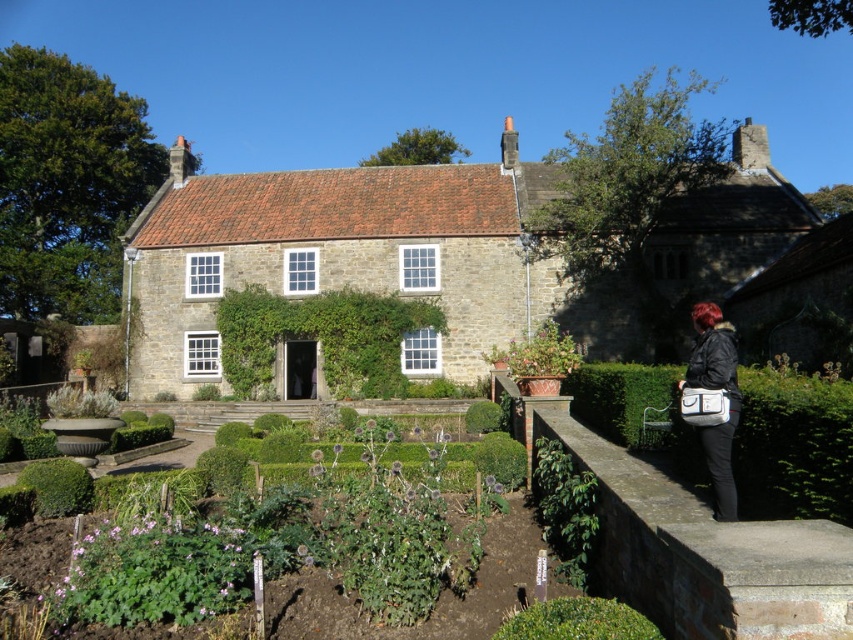
Does stone cottage at center come behind brown stone ledge at lower right?

Yes, it is behind brown stone ledge at lower right.

Does stone cottage at center have a larger size compared to brown stone ledge at lower right?

Correct, stone cottage at center is larger in size than brown stone ledge at lower right.

Find the location of a particular element. This screenshot has width=853, height=640. stone cottage at center is located at coordinates (351, 260).

Locate an element on the screen. stone cottage at center is located at coordinates (351, 260).

Can you confirm if stone cottage at center is positioned to the left of green leafy hedge at center?

In fact, stone cottage at center is to the right of green leafy hedge at center.

Can you confirm if stone cottage at center is shorter than green leafy hedge at center?

No.

Describe the element at coordinates (351, 260) in the screenshot. This screenshot has height=640, width=853. I see `stone cottage at center` at that location.

Where is `stone cottage at center`? The height and width of the screenshot is (640, 853). stone cottage at center is located at coordinates (351, 260).

Does point (776, 410) come in front of point (381, 316)?

That is True.

Which is below, green leafy hedge at right or green leafy hedge at center?

green leafy hedge at right is lower down.

At what (x,y) coordinates should I click in order to perform the action: click on green leafy hedge at right. Please return your answer as a coordinate pair (x, y). Image resolution: width=853 pixels, height=640 pixels. Looking at the image, I should click on (793, 449).